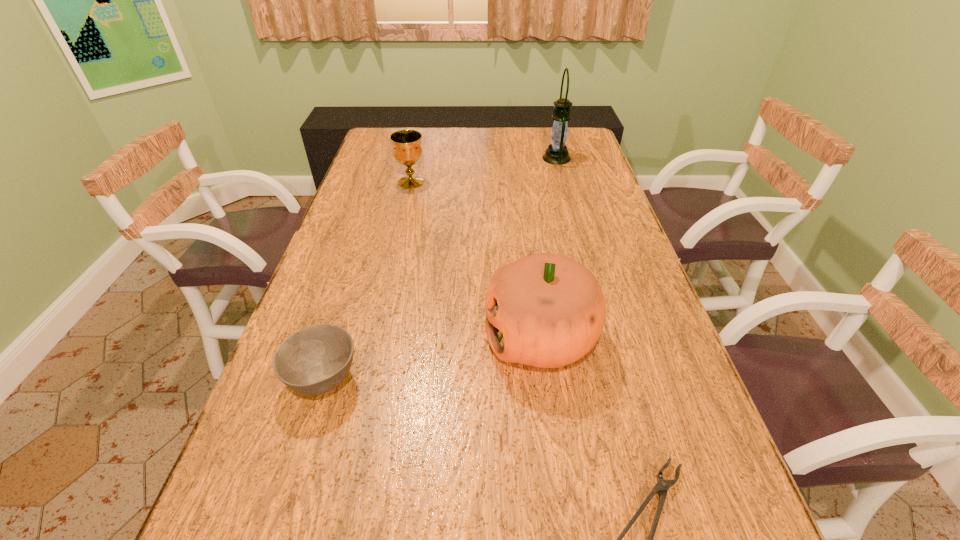
Locate an element on the screen. The width and height of the screenshot is (960, 540). the farthest object is located at coordinates (556, 153).

Locate an element on the screen. The image size is (960, 540). the tallest object is located at coordinates (556, 153).

Where is `pumpkin`? This screenshot has height=540, width=960. pumpkin is located at coordinates (x=545, y=310).

You are a GUI agent. You are given a task and a screenshot of the screen. Output one action in this format:
    pyautogui.click(x=<x>, y=<y>)
    Task: Click on the second farthest object
    This screenshot has height=540, width=960.
    Given the screenshot: What is the action you would take?
    pyautogui.click(x=407, y=150)

You are a GUI agent. You are given a task and a screenshot of the screen. Output one action in this format:
    pyautogui.click(x=<x>, y=<y>)
    Task: Click on the chalice
    Image resolution: width=960 pixels, height=540 pixels.
    Given the screenshot: What is the action you would take?
    pyautogui.click(x=407, y=150)

At what (x,y) coordinates should I click in order to perform the action: click on bowl. Please return your answer as a coordinate pair (x, y). Looking at the image, I should click on (312, 361).

Where is `vacant region located on the side where the farthest object emits light`? The height and width of the screenshot is (540, 960). vacant region located on the side where the farthest object emits light is located at coordinates (486, 158).

Find the location of a particular element. free spot located on the side where the farthest object emits light is located at coordinates (448, 158).

The image size is (960, 540). I want to click on free location located 0.120m on the side where the farthest object emits light, so click(510, 158).

Image resolution: width=960 pixels, height=540 pixels. Identify the location of vacant region located on the face of the pumpkin. (x=367, y=337).